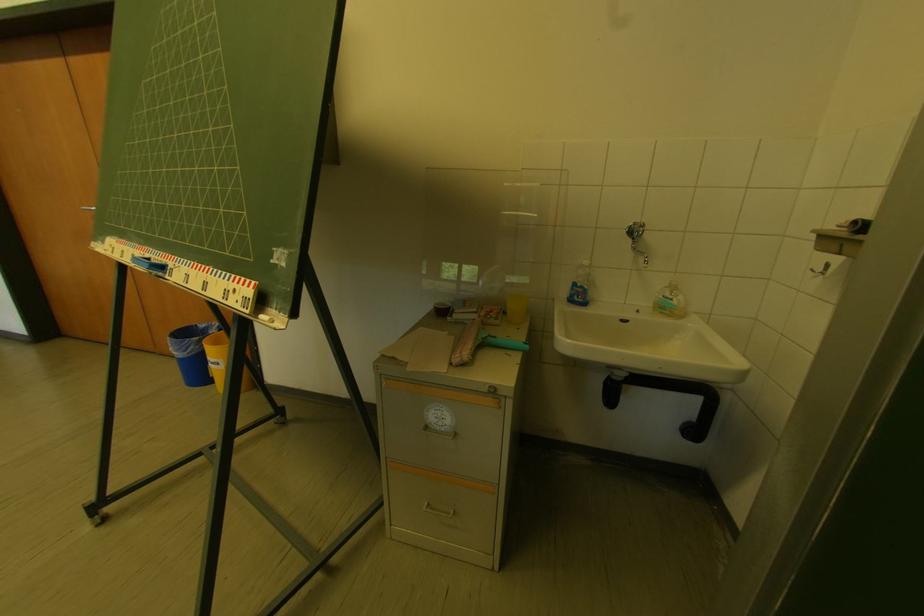
Find where to lift the yellow plastic cup. Please return your answer as a coordinate pair (x, y).

(216, 357)